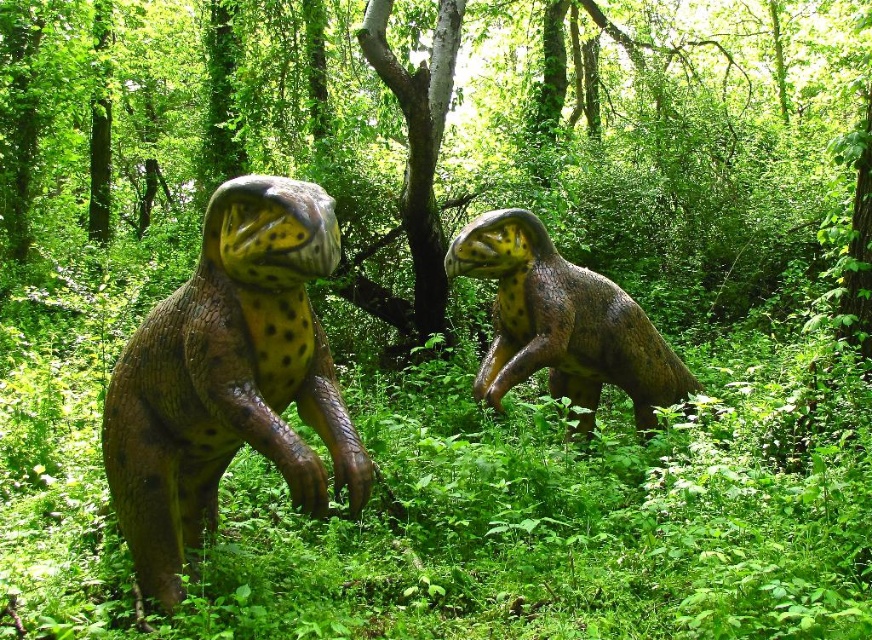
Question: Is brown textured dinosaur at left thinner than brown textured dinosaur at center?

Choices:
 (A) no
 (B) yes

Answer: (B)

Question: Among these points, which one is nearest to the camera?

Choices:
 (A) (169, 352)
 (B) (532, 291)

Answer: (A)

Question: Can you confirm if brown textured dinosaur at left is thinner than brown textured dinosaur at center?

Choices:
 (A) yes
 (B) no

Answer: (A)

Question: Among these points, which one is farthest from the camera?

Choices:
 (A) (296, 248)
 (B) (499, 408)

Answer: (B)

Question: Can you confirm if brown textured dinosaur at left is thinner than brown textured dinosaur at center?

Choices:
 (A) no
 (B) yes

Answer: (B)